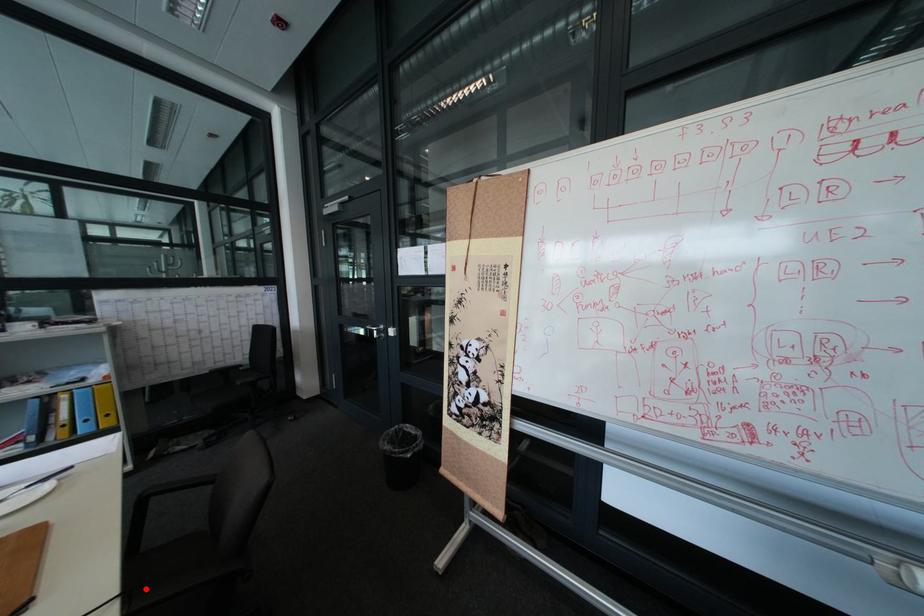
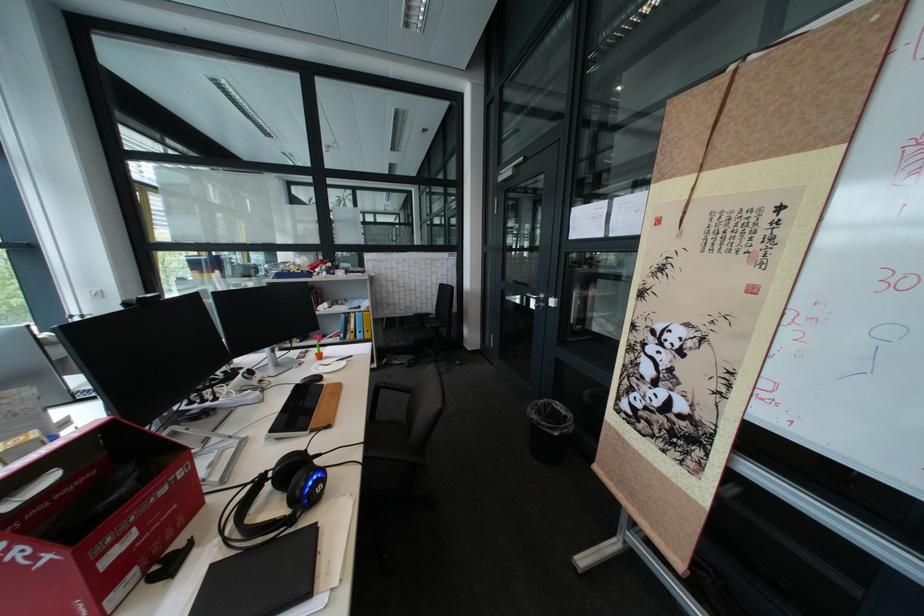
Question: I am providing you with two images of the same scene from different viewpoints. A red point is shown in image1. For the corresponding object point in image2, is it positioned nearer or farther from the camera?

Choices:
 (A) Nearer
 (B) Farther

Answer: (A)